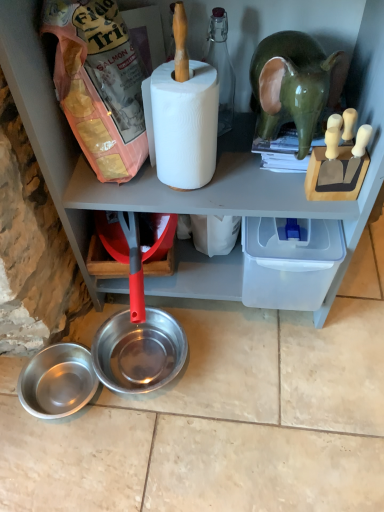
Where is `free space in front of shiny metallic bowl at lower center, the 1th bowl when ordered from right to left`? This screenshot has height=512, width=384. free space in front of shiny metallic bowl at lower center, the 1th bowl when ordered from right to left is located at coordinates (147, 453).